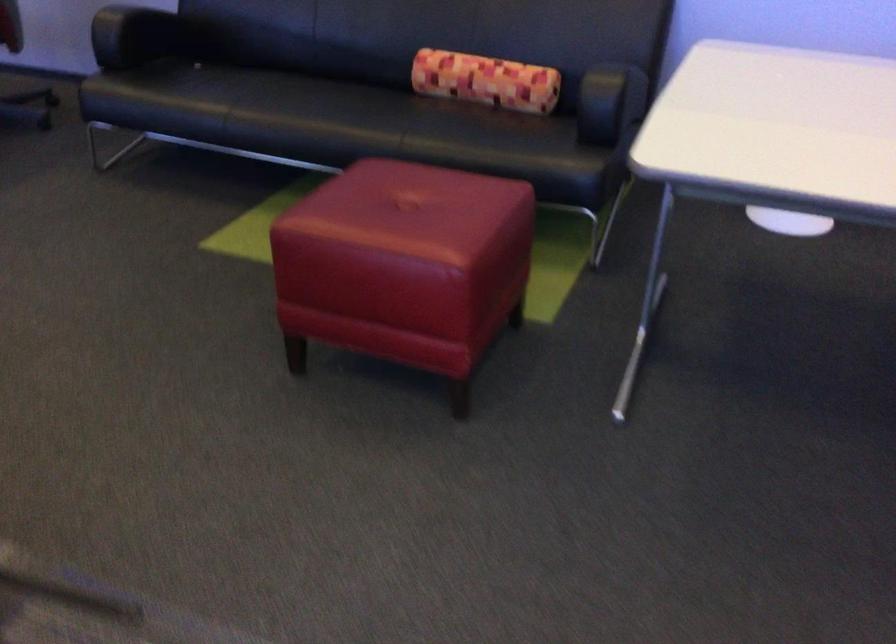
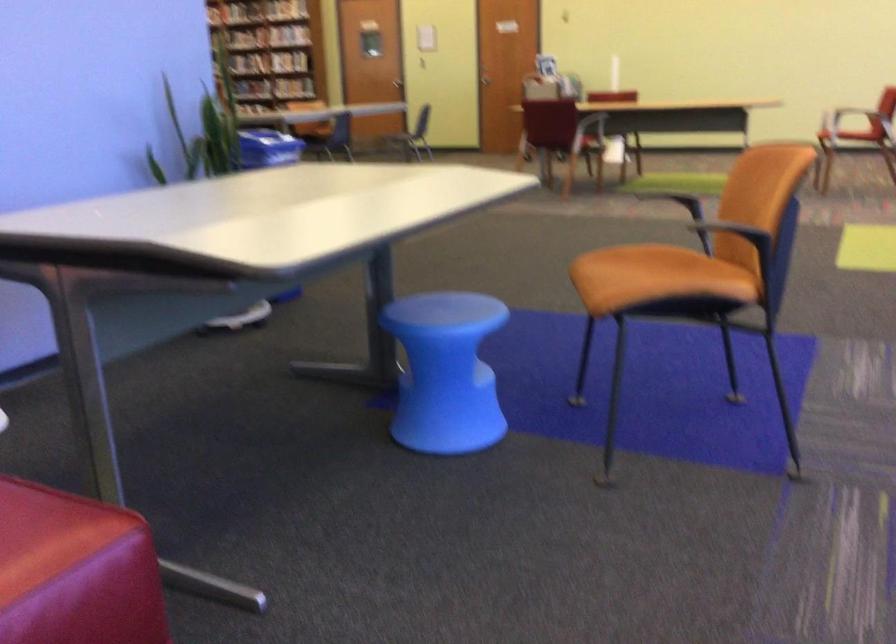
Find the pixel in the second image that matches the point at 435,240 in the first image.

(47, 534)